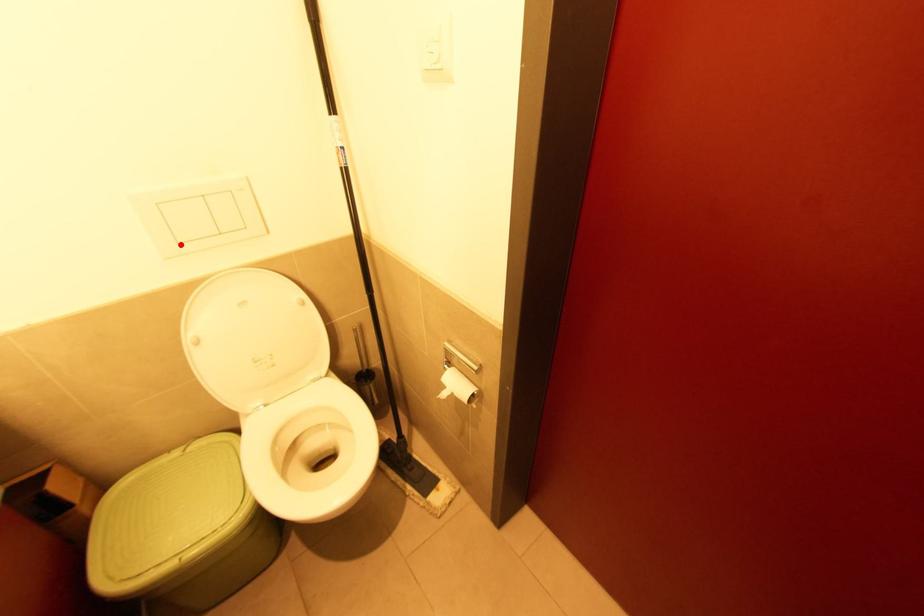
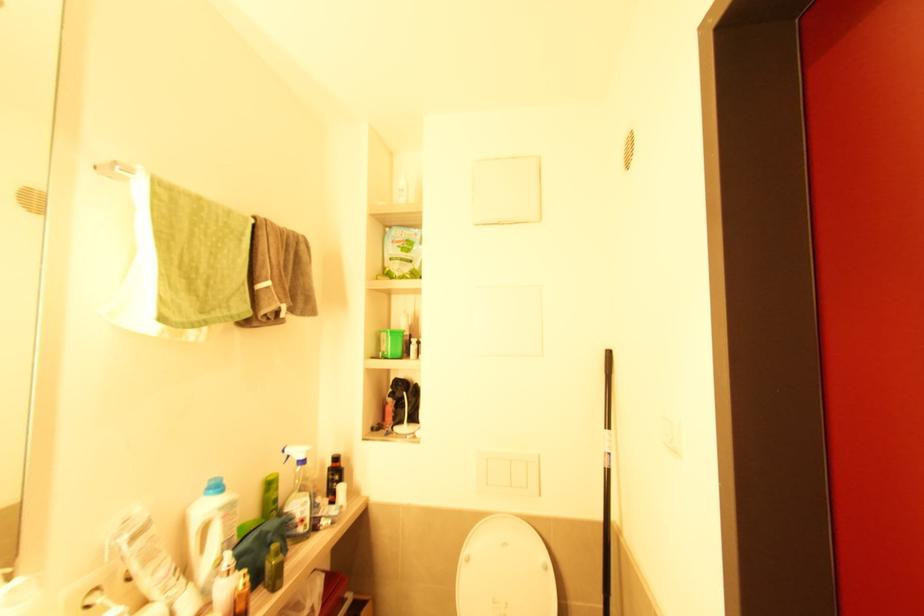
Find the pixel in the second image that matches the highlighted location in the first image.

(489, 485)